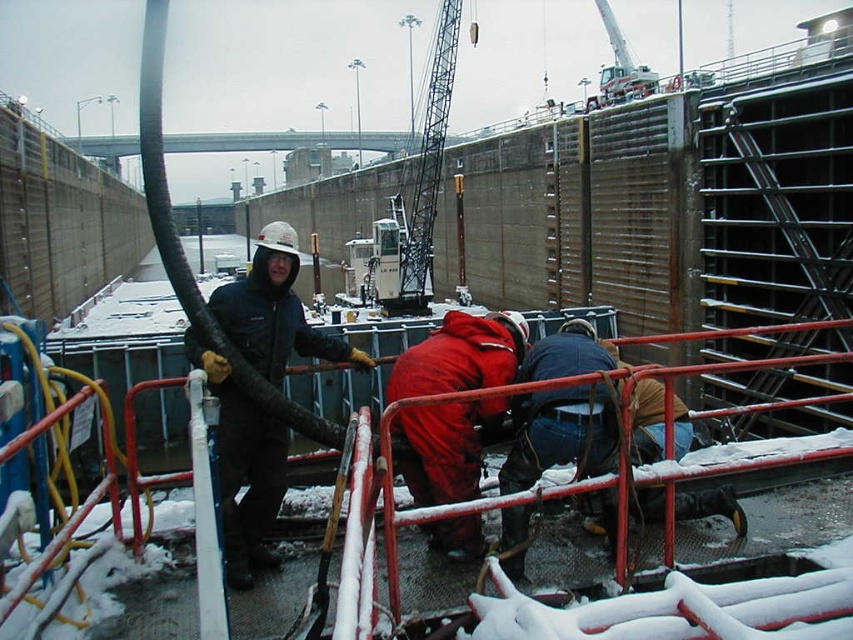
You are a safety inspector at the construction site. You need to check the visibility of the red matte jumpsuit at center and the white metal crane at center. Which object is closer to you?

The red matte jumpsuit at center is closer to you because it is in front of the white metal crane at center.

From the picture: You are a safety inspector at the construction site. You need to ensure that the red matte jumpsuit at center and the white metal crane at center are positioned safely. According to the safety protocol, the jumpsuit should be on the left side of the crane. Is the current arrangement compliant with the safety protocol?

The red matte jumpsuit at center is positioned on the right side of white metal crane at center, so the current arrangement is not compliant with the safety protocol which requires the jumpsuit to be on the left side of the crane.

Based on the photo, you are standing at the edge of the snow covered construction site and see two points marked in the image. Which point, point (445, 436) or point (448, 84), is closer to you?

Point (445, 436) is closer to the viewer than point (448, 84).